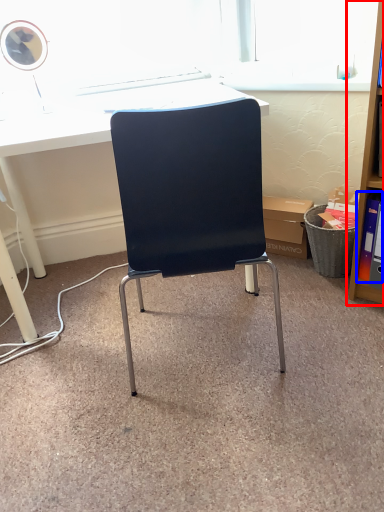
Question: Which object is closer to the camera taking this photo, shelf (highlighted by a red box) or book (highlighted by a blue box)?

Choices:
 (A) shelf
 (B) book

Answer: (A)